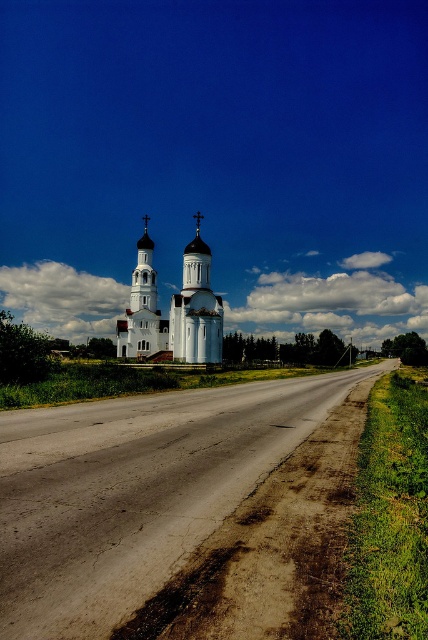
Based on the photo, can you confirm if white smooth church at center is bigger than white stone spire at center?

Correct, white smooth church at center is larger in size than white stone spire at center.

Does white smooth church at center appear on the right side of white stone spire at center?

Yes, white smooth church at center is to the right of white stone spire at center.

Locate an element on the screen. This screenshot has width=428, height=640. white smooth church at center is located at coordinates (172, 308).

Looking at this image, does brown dirt track at center have a greater width compared to white stone spire at center?

Correct, the width of brown dirt track at center exceeds that of white stone spire at center.

Does point (71, 445) come closer to viewer compared to point (139, 243)?

Yes.

Is point (115, 436) more distant than point (163, 340)?

No, (115, 436) is in front of (163, 340).

Locate an element on the screen. This screenshot has height=640, width=428. brown dirt track at center is located at coordinates (134, 484).

Who is more distant from viewer, (91,429) or (125,344)?

Point (125,344)

Is point (30, 556) closer to viewer compared to point (125, 348)?

That is True.

The height and width of the screenshot is (640, 428). I want to click on brown dirt track at center, so click(134, 484).